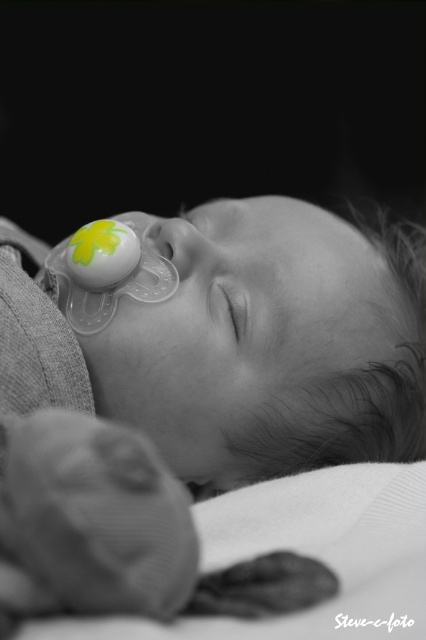
The width and height of the screenshot is (426, 640). Describe the element at coordinates (199, 392) in the screenshot. I see `transparent pacifier at center` at that location.

Can you confirm if transparent pacifier at center is positioned to the left of transparent plastic pacifier at upper left?

Incorrect, transparent pacifier at center is not on the left side of transparent plastic pacifier at upper left.

Which is in front, point (264, 349) or point (98, 300)?

Point (264, 349)

Find the location of a particular element. This screenshot has height=640, width=426. transparent pacifier at center is located at coordinates (199, 392).